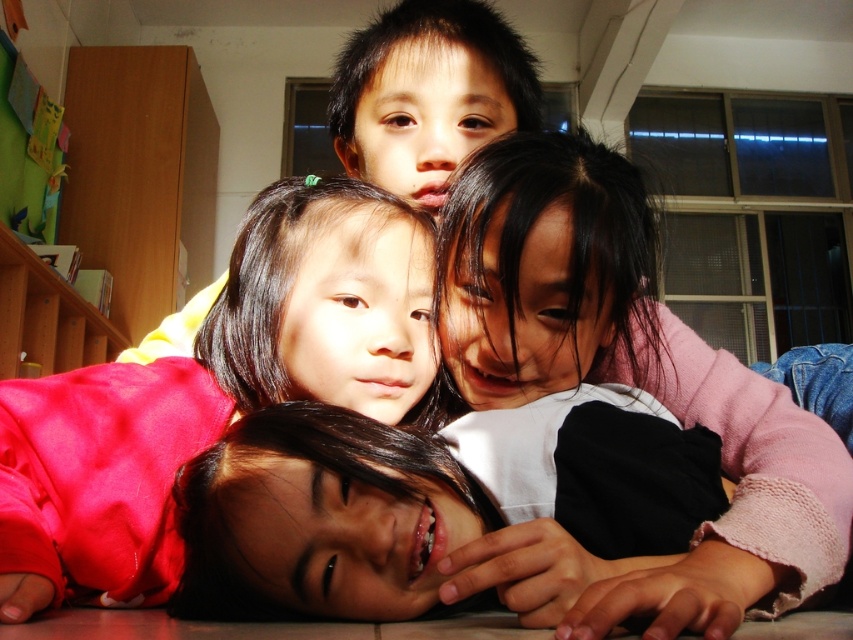
Question: Is smooth skin child at center to the left of smooth skin face at upper center from the viewer's perspective?

Choices:
 (A) no
 (B) yes

Answer: (A)

Question: Among these points, which one is nearest to the camera?

Choices:
 (A) (519, 442)
 (B) (306, 378)

Answer: (A)

Question: Estimate the real-world distances between objects in this image. Which object is farther from the smooth pink sweater at center?

Choices:
 (A) smooth skin child at center
 (B) smooth skin face at upper center

Answer: (B)

Question: Can you confirm if smooth skin child at center is smaller than smooth skin face at upper center?

Choices:
 (A) no
 (B) yes

Answer: (A)

Question: Which of the following is the closest to the observer?

Choices:
 (A) smooth skin face at upper center
 (B) smooth skin child at center

Answer: (B)

Question: Does smooth skin child at center appear on the right side of smooth pink sweater at center?

Choices:
 (A) yes
 (B) no

Answer: (A)